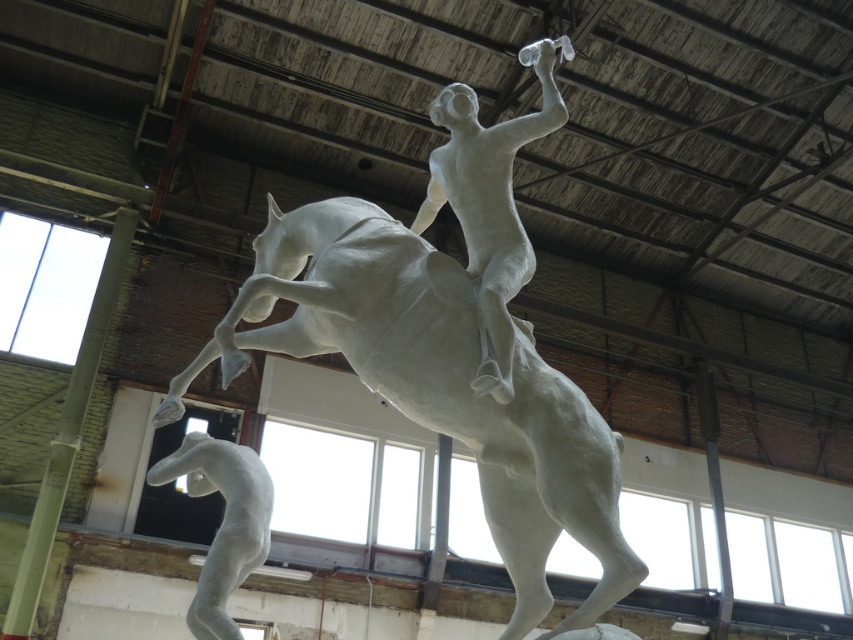
You are an art curator planning to display the white matte figure at center and the white matte horse at lower left in a gallery. The gallery has a narrow corridor that is 2 meters wide. If you want to place both sculptures side by side in the corridor, will their combined width exceed the corridor width?

The white matte figure at center is wider than the white matte horse at lower left. However, without knowing the exact widths of both sculptures, it is impossible to determine if their combined width exceeds the 2 meter corridor. Additional measurements are needed.

You are an art curator planning to install a spotlight on the white matte figure at center. The spotlight has a beam angle of 30 degrees and needs to illuminate the figure without spilling light onto the surrounding sculpture. Given the coordinates of the figure at point (490,204), can you confirm if the spotlight placement at this point will achieve the desired effect?

The point (490,204) indicates the white matte figure at center. Since the spotlight is placed directly at this point, its beam angle of 30 degrees would spread outward from the figure, potentially spilling light onto adjacent parts of the sculpture. Therefore, the spotlight placement may not achieve the desired effect of isolating the figure without affecting the surroundings.